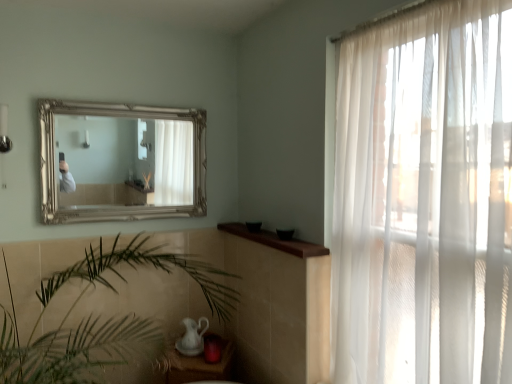
This screenshot has height=384, width=512. Describe the element at coordinates (99, 319) in the screenshot. I see `green leafy plant at center` at that location.

Where is `matte white table at lower center`? The width and height of the screenshot is (512, 384). matte white table at lower center is located at coordinates (200, 366).

Image resolution: width=512 pixels, height=384 pixels. Find the location of `brown wood window sill at center`. brown wood window sill at center is located at coordinates (275, 240).

Where is `green leafy plant at center`? green leafy plant at center is located at coordinates (99, 319).

Image resolution: width=512 pixels, height=384 pixels. I want to click on mirror in front of the matte white table at lower center, so click(125, 161).

From a real-world perspective, is matte white table at lower center positioned above or below gold metallic mirror at upper center?

Clearly, from a real-world perspective, matte white table at lower center is below gold metallic mirror at upper center.

Does matte white table at lower center lie behind gold metallic mirror at upper center?

Yes, matte white table at lower center is further from the viewer.

Is matte white table at lower center taller or shorter than gold metallic mirror at upper center?

Considering their sizes, matte white table at lower center has less height than gold metallic mirror at upper center.

Is brown wood window sill at center beside sheer white curtain at right?

No, brown wood window sill at center is not making contact with sheer white curtain at right.

From a real-world perspective, is brown wood window sill at center physically located above or below sheer white curtain at right?

In terms of real-world spatial position, brown wood window sill at center is below sheer white curtain at right.

From the image's perspective, is brown wood window sill at center over sheer white curtain at right?

No.

From the picture: Is sheer white curtain at right far away from green leafy plant at center?

That's right, there is a large distance between sheer white curtain at right and green leafy plant at center.

Between sheer white curtain at right and green leafy plant at center, which one is positioned in front?

sheer white curtain at right is closer to the camera.

Is sheer white curtain at right situated inside green leafy plant at center or outside?

sheer white curtain at right cannot be found inside green leafy plant at center.

Is sheer white curtain at right at the left side of green leafy plant at center?

No.

Is there a large distance between brown wood window sill at center and white glossy tea pot at lower center?

Actually, brown wood window sill at center and white glossy tea pot at lower center are a little close together.

From the image's perspective, who appears lower, brown wood window sill at center or white glossy tea pot at lower center?

white glossy tea pot at lower center, from the image's perspective.

In the scene shown: From a real-world perspective, is brown wood window sill at center physically located above or below white glossy tea pot at lower center?

From a real-world perspective, brown wood window sill at center is physically above white glossy tea pot at lower center.

Which is more to the left, white glossy tea pot at lower center or sheer white curtain at right?

white glossy tea pot at lower center is more to the left.

From a real-world perspective, is white glossy tea pot at lower center above or below sheer white curtain at right?

From a real-world perspective, white glossy tea pot at lower center is physically below sheer white curtain at right.

Is white glossy tea pot at lower center facing towards sheer white curtain at right?

No, white glossy tea pot at lower center is not facing towards sheer white curtain at right.

Can we say white glossy tea pot at lower center lies outside sheer white curtain at right?

Yes, white glossy tea pot at lower center is not within sheer white curtain at right.

From a real-world perspective, is sheer white curtain at right below brown wood window sill at center?

No.

Between sheer white curtain at right and brown wood window sill at center, which one has larger size?

Bigger between the two is sheer white curtain at right.

Is sheer white curtain at right oriented away from brown wood window sill at center?

No, sheer white curtain at right is not facing the opposite direction of brown wood window sill at center.

Who is smaller, sheer white curtain at right or white glossy tea pot at lower center?

With smaller size is white glossy tea pot at lower center.

How much distance is there between sheer white curtain at right and white glossy tea pot at lower center?

sheer white curtain at right is 4.94 feet from white glossy tea pot at lower center.

Is sheer white curtain at right facing away from white glossy tea pot at lower center?

sheer white curtain at right does not have its back to white glossy tea pot at lower center.

From a real-world perspective, which is physically below, sheer white curtain at right or white glossy tea pot at lower center?

white glossy tea pot at lower center is physically lower.

In the image, there is a gold metallic mirror at upper center. Where is `table below it (from the image's perspective)`? table below it (from the image's perspective) is located at coordinates (200, 366).

You are a GUI agent. You are given a task and a screenshot of the screen. Output one action in this format:
    pyautogui.click(x=<x>, y=<y>)
    Task: Click on the window sill behind the sheer white curtain at right
    The width and height of the screenshot is (512, 384).
    Given the screenshot: What is the action you would take?
    pyautogui.click(x=275, y=240)

Looking at the image, which one is located further to white glossy tea pot at lower center, sheer white curtain at right or green leafy plant at center?

The object further to white glossy tea pot at lower center is sheer white curtain at right.

Considering their positions, is matte white table at lower center positioned closer to gold metallic mirror at upper center than sheer white curtain at right?

matte white table at lower center lies closer to gold metallic mirror at upper center than the other object.

From the image, which object appears to be nearer to brown wood window sill at center, gold metallic mirror at upper center or white glossy tea pot at lower center?

Among the two, white glossy tea pot at lower center is located nearer to brown wood window sill at center.

Based on their spatial positions, is brown wood window sill at center or gold metallic mirror at upper center further from white glossy tea pot at lower center?

gold metallic mirror at upper center.

Which object lies nearer to the anchor point green leafy plant at center, matte white table at lower center or sheer white curtain at right?

matte white table at lower center is closer to green leafy plant at center.

Estimate the real-world distances between objects in this image. Which object is further from brown wood window sill at center, sheer white curtain at right or matte white table at lower center?

The object further to brown wood window sill at center is matte white table at lower center.

Which object lies nearer to the anchor point green leafy plant at center, gold metallic mirror at upper center or sheer white curtain at right?

Answer: gold metallic mirror at upper center is closer to green leafy plant at center.

Based on their spatial positions, is sheer white curtain at right or white glossy tea pot at lower center closer to brown wood window sill at center?

Among the two, sheer white curtain at right is located nearer to brown wood window sill at center.

Where is `window sill between gold metallic mirror at upper center and matte white table at lower center from top to bottom`? The height and width of the screenshot is (384, 512). window sill between gold metallic mirror at upper center and matte white table at lower center from top to bottom is located at coordinates pos(275,240).

This screenshot has height=384, width=512. Find the location of `table between green leafy plant at center and white glossy tea pot at lower center from front to back`. table between green leafy plant at center and white glossy tea pot at lower center from front to back is located at coordinates (200, 366).

You are a GUI agent. You are given a task and a screenshot of the screen. Output one action in this format:
    pyautogui.click(x=<x>, y=<y>)
    Task: Click on the mirror between sheer white curtain at right and matte white table at lower center from front to back
    This screenshot has width=512, height=384.
    Given the screenshot: What is the action you would take?
    pyautogui.click(x=125, y=161)

Find the location of a particular element. window sill located between green leafy plant at center and white glossy tea pot at lower center in the depth direction is located at coordinates (275, 240).